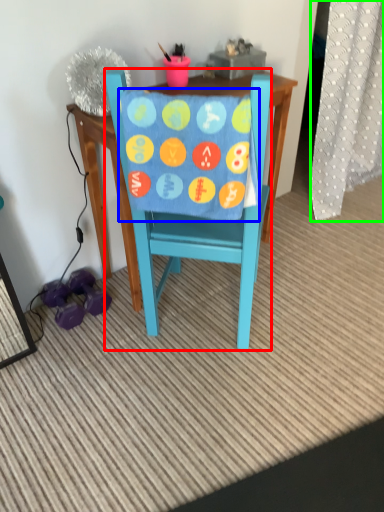
Question: Considering the real-world distances, which object is closest to chair (highlighted by a red box)? blanket (highlighted by a blue box) or curtain (highlighted by a green box).

Choices:
 (A) blanket
 (B) curtain

Answer: (A)